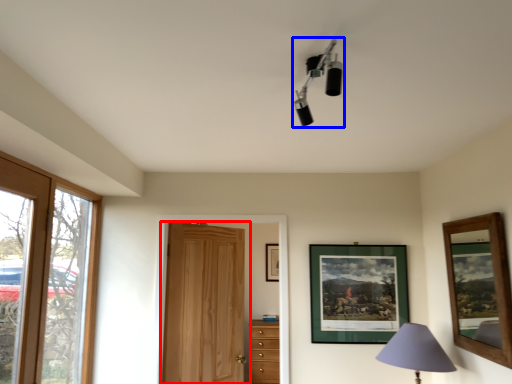
Question: Which of the following is the closest to the observer, door (highlighted by a red box) or lamp (highlighted by a blue box)?

Choices:
 (A) door
 (B) lamp

Answer: (B)